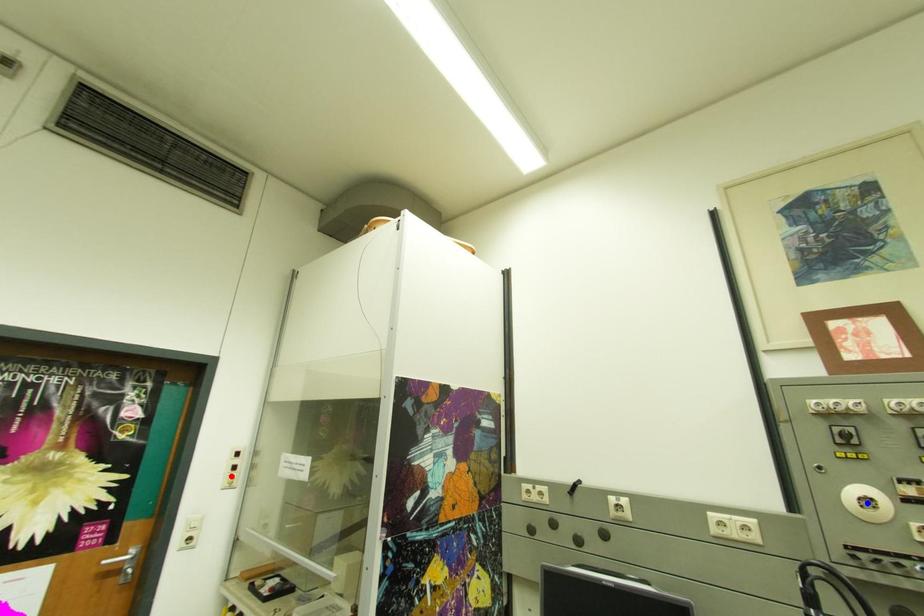
Question: Two points are marked on the image. Which point is closer to the camera?

Choices:
 (A) Blue point is closer.
 (B) Red point is closer.

Answer: (A)